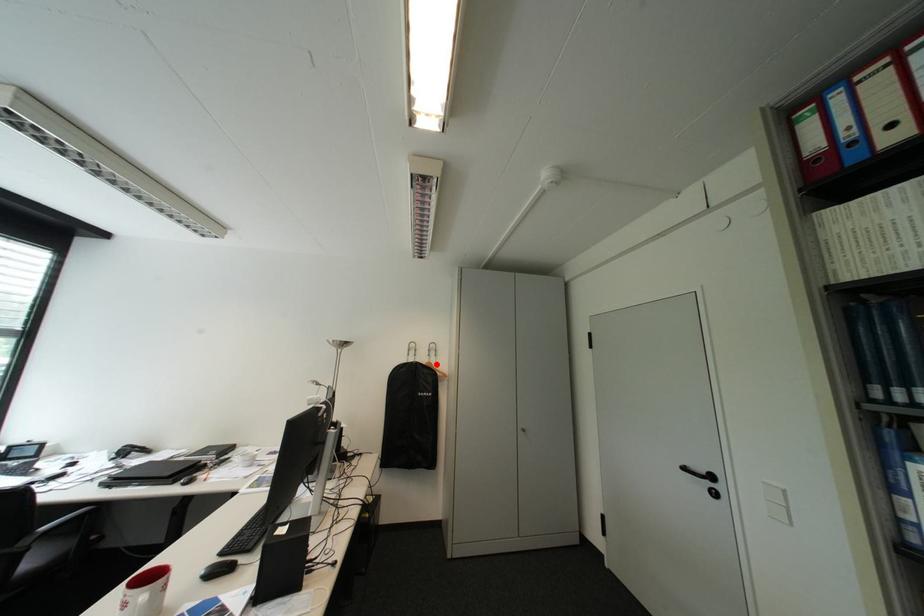
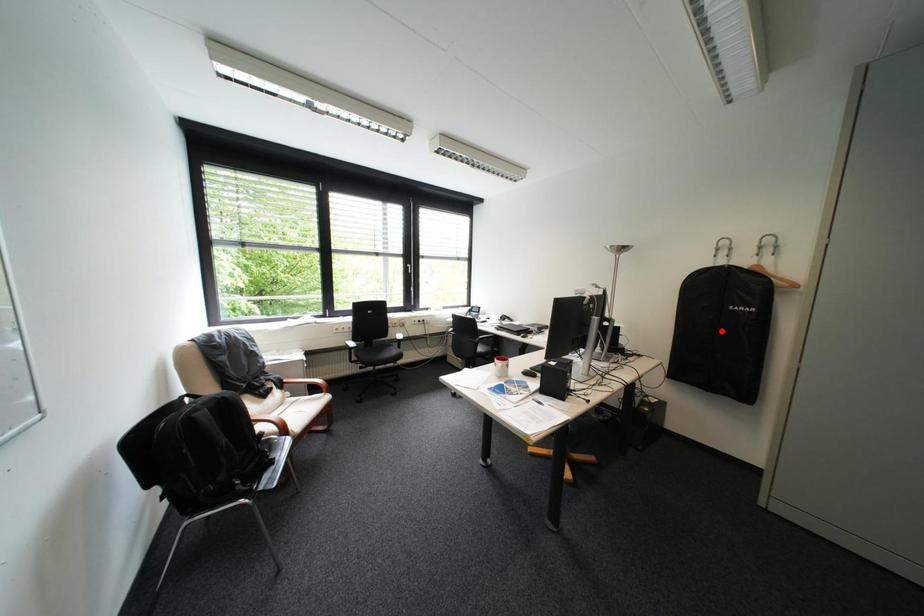
I am providing you with two images of the same scene from different viewpoints. A red point is marked on the first image and another point is marked on the second image. Are the points marked in image1 and image2 representing the same 3D position?

No